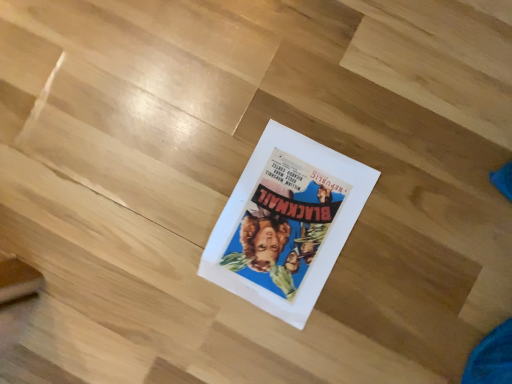
I want to click on vacant area to the left of white paper poster at center, so click(x=172, y=291).